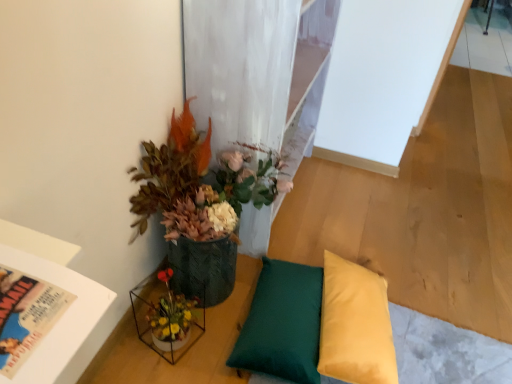
The width and height of the screenshot is (512, 384). I want to click on blank area beneath textured green pot at upper left (from a real-world perspective), so click(226, 293).